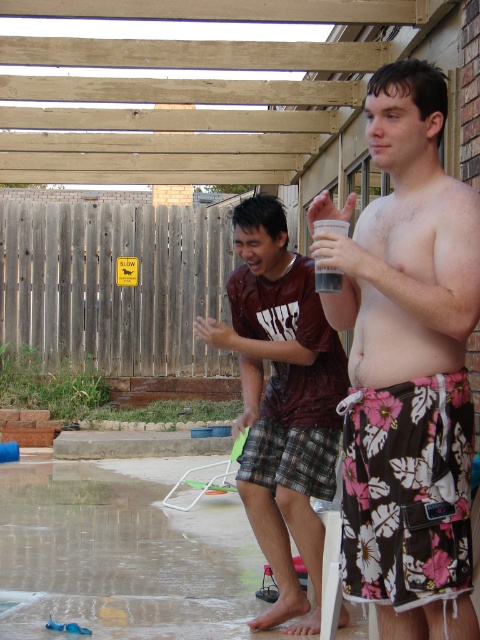
Question: Which point is closer to the camera taking this photo?

Choices:
 (A) (432, 198)
 (B) (326, 285)

Answer: (A)

Question: Is floral swim trunks at center bigger than transparent plastic cup at upper center?

Choices:
 (A) no
 (B) yes

Answer: (B)

Question: Which object appears farthest from the camera in this image?

Choices:
 (A) transparent plastic cup at upper center
 (B) pink floral shorts at right
 (C) brown plaid shorts at center

Answer: (C)

Question: Based on their relative distances, which object is nearer to the brown plaid shorts at center?

Choices:
 (A) floral swim trunks at center
 (B) pink floral shorts at right

Answer: (A)

Question: Can you confirm if floral swim trunks at center is positioned to the left of brown plaid shorts at center?

Choices:
 (A) yes
 (B) no

Answer: (B)

Question: Does brown plaid shorts at center appear on the left side of transparent plastic cup at upper center?

Choices:
 (A) yes
 (B) no

Answer: (A)